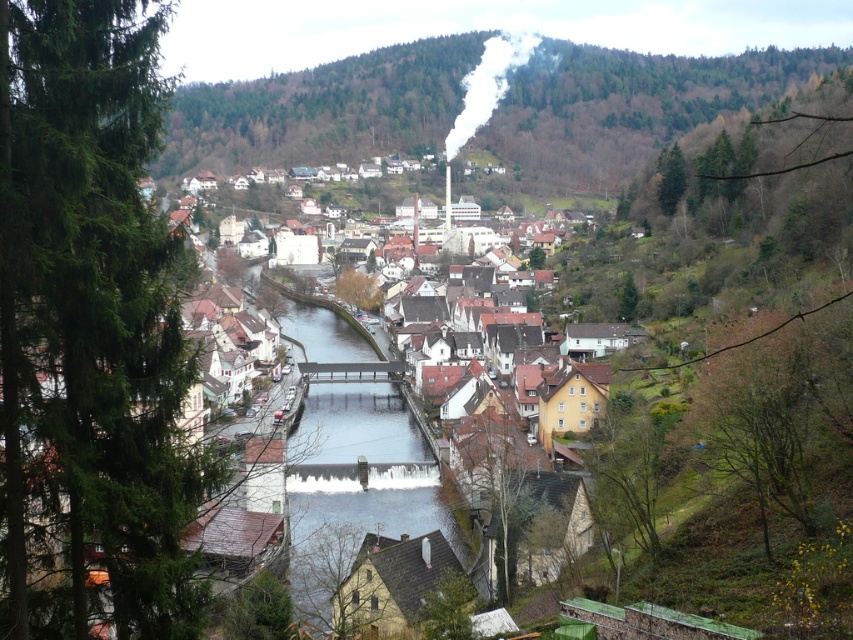
Which is behind, point (440, 520) or point (531, 33)?

The point (531, 33) is behind.

Is smooth concrete bridge at center above white smoke at upper center?

No, smooth concrete bridge at center is not above white smoke at upper center.

This screenshot has width=853, height=640. In order to click on smooth concrete bridge at center in this screenshot , I will do `click(352, 484)`.

Does green forested hillside at upper center appear over smooth concrete bridge at center?

Indeed, green forested hillside at upper center is positioned over smooth concrete bridge at center.

Where is `green forested hillside at upper center`? The height and width of the screenshot is (640, 853). green forested hillside at upper center is located at coordinates (627, 104).

Which of these two, green forested hillside at upper center or white smoke at upper center, stands taller?

green forested hillside at upper center

Does green forested hillside at upper center have a greater height compared to white smoke at upper center?

Yes, green forested hillside at upper center is taller than white smoke at upper center.

Does point (248, 144) lie in front of point (521, 44)?

Yes, point (248, 144) is closer to viewer.

You are a GUI agent. You are given a task and a screenshot of the screen. Output one action in this format:
    pyautogui.click(x=<x>, y=<y>)
    Task: Click on the green forested hillside at upper center
    Image resolution: width=853 pixels, height=640 pixels.
    Given the screenshot: What is the action you would take?
    pyautogui.click(x=627, y=104)